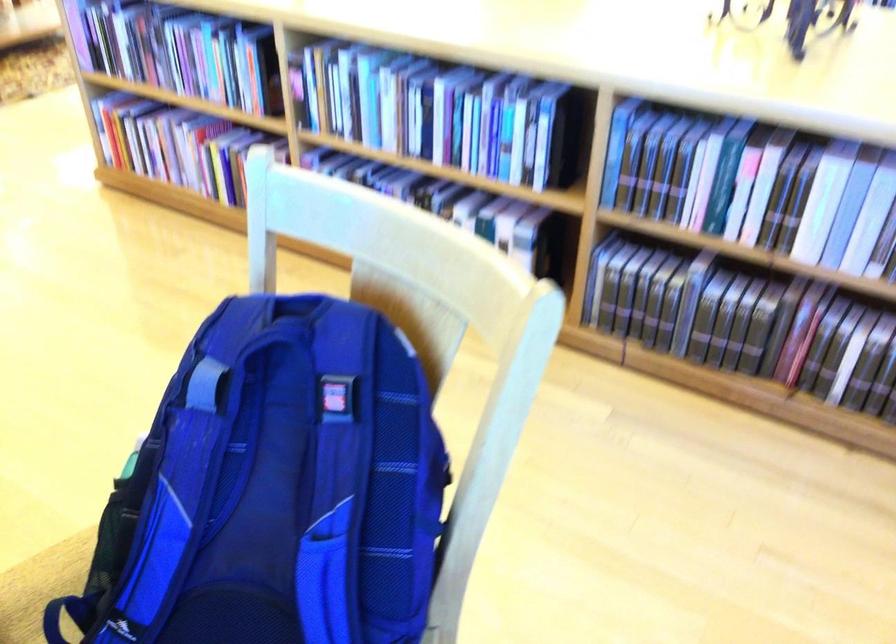
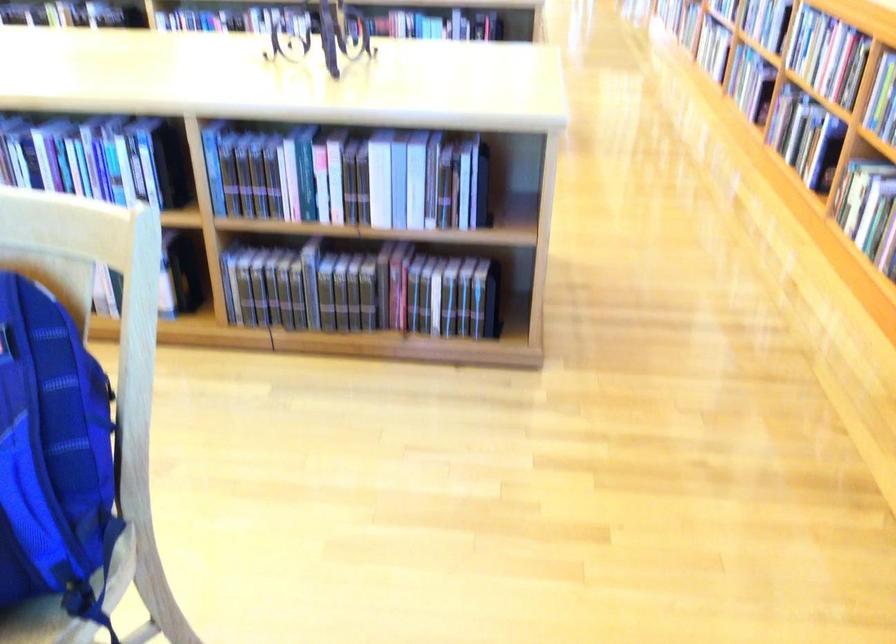
The point at (765, 190) is marked in the first image. Where is the corresponding point in the second image?

(334, 176)